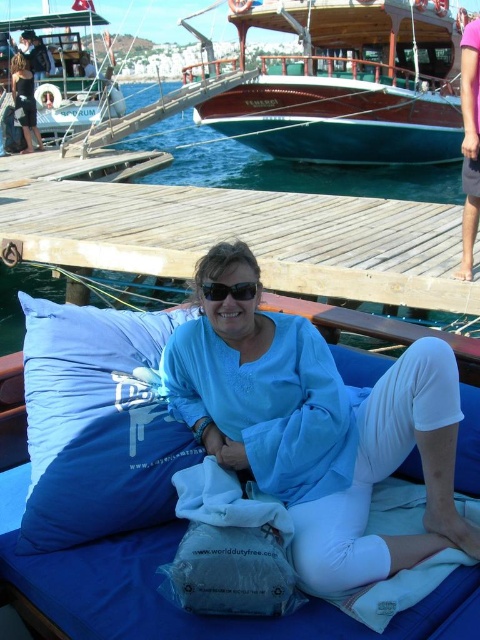
Question: Is blue cotton shirt at center wider than black plastic sunglasses at center?

Choices:
 (A) no
 (B) yes

Answer: (B)

Question: Does wooden polished boat at upper center appear under wooden boat at upper left?

Choices:
 (A) yes
 (B) no

Answer: (A)

Question: Which point is farther to the camera?

Choices:
 (A) (215, 298)
 (B) (394, 90)
 (C) (305, 259)
 (D) (21, 124)

Answer: (D)

Question: Is blue cotton shirt at center to the right of wooden boat at upper left from the viewer's perspective?

Choices:
 (A) no
 (B) yes

Answer: (B)

Question: Which point appears farthest from the camera in this image?

Choices:
 (A) (256, 362)
 (B) (121, 337)
 (C) (24, 202)
 (D) (247, 92)

Answer: (D)

Question: Which object appears farthest from the camera in this image?

Choices:
 (A) wooden at center
 (B) black fabric dress at upper left

Answer: (B)